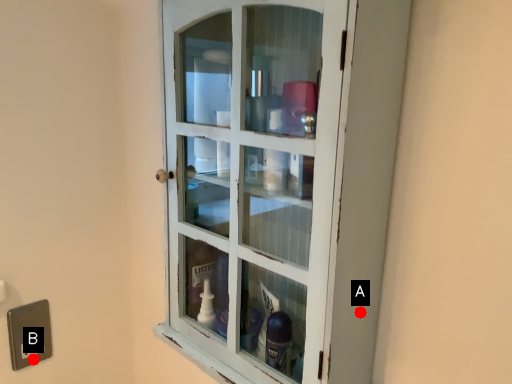
Question: Two points are circled on the image, labeled by A and B beside each circle. Which point appears farthest from the camera in this image?

Choices:
 (A) A is further
 (B) B is further

Answer: (B)